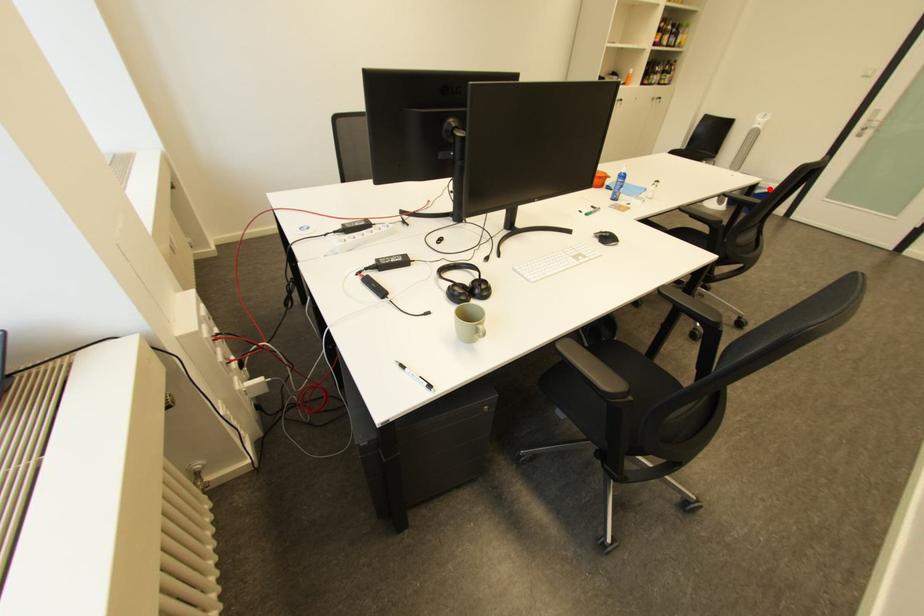
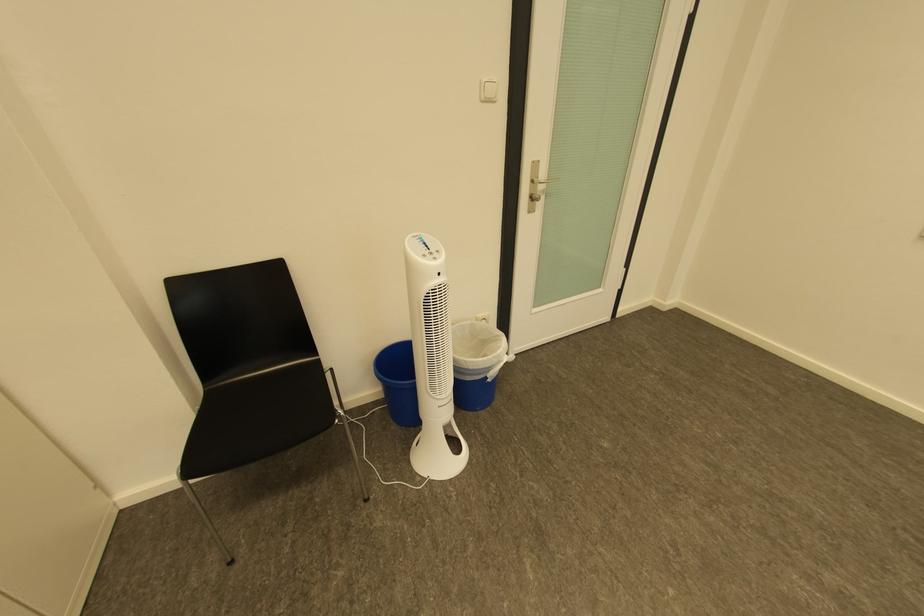
Find the pixel in the second image that matches the highlighted location in the first image.

(499, 370)